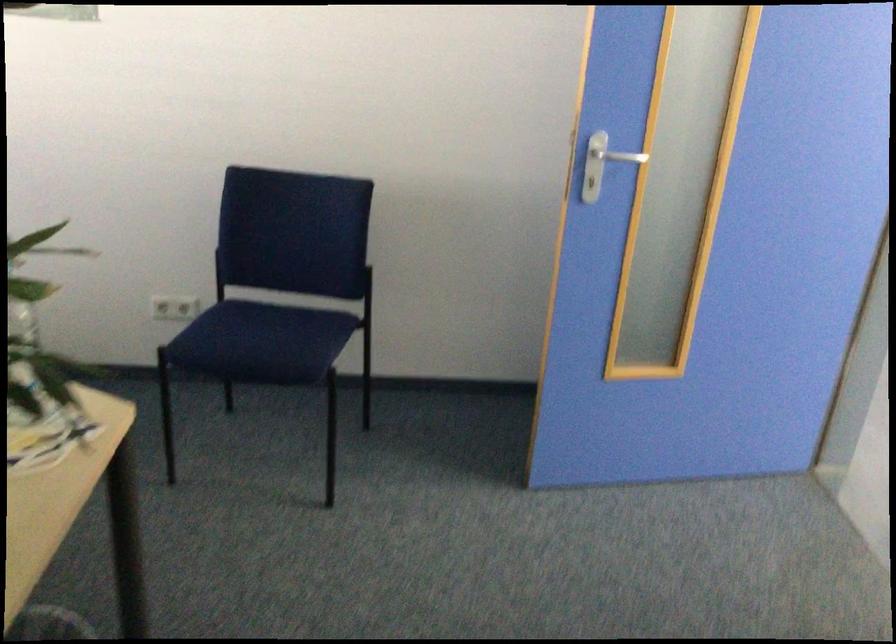
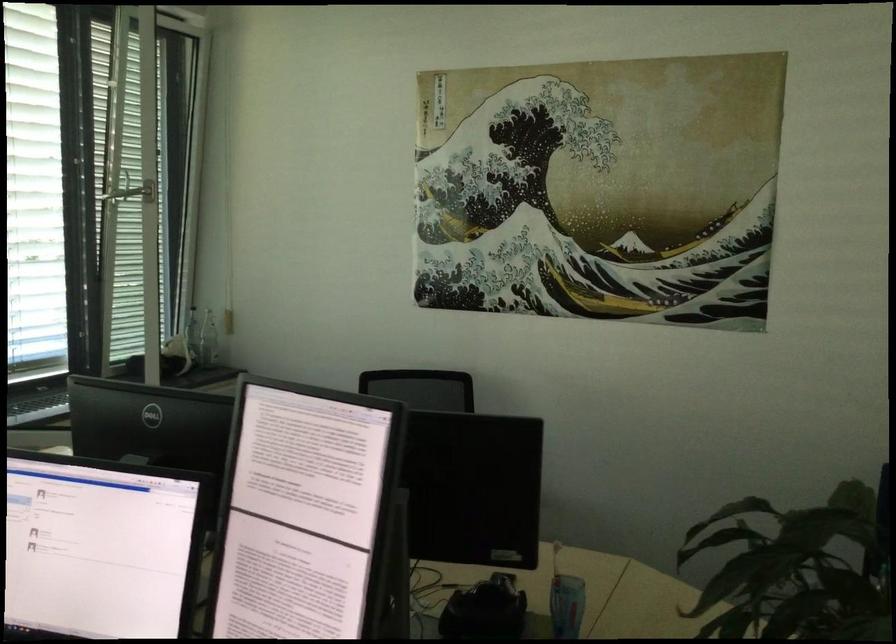
Question: I am providing you with two images of the same scene from different viewpoints. Which of the following objects are not visible in image2?

Choices:
 (A) white power outlet
 (B) fabric box handle
 (C) blue patterned cup
 (D) silver door handle

Answer: (A)